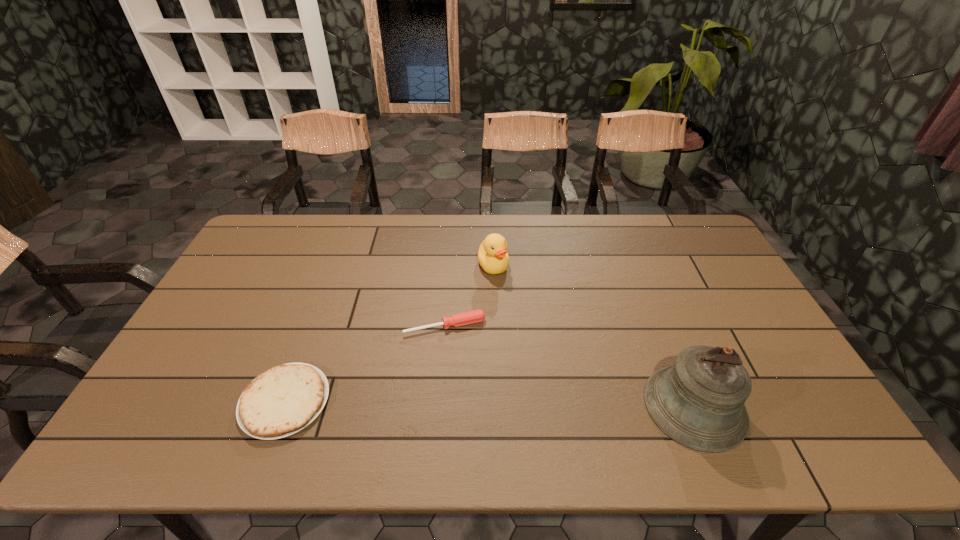
Locate an element on the screen. This screenshot has height=540, width=960. free space located at the beak of the farthest object is located at coordinates [x=515, y=329].

This screenshot has width=960, height=540. What are the coordinates of `vacant space located at the blade of the third nearest object` in the screenshot? It's located at (460, 349).

You are a GUI agent. You are given a task and a screenshot of the screen. Output one action in this format:
    pyautogui.click(x=<x>, y=<y>)
    Task: Click on the vacant region located 0.050m at the blade of the third nearest object
    The image size is (960, 540).
    Given the screenshot: What is the action you would take?
    pyautogui.click(x=460, y=349)

Where is `vacant region located 0.180m at the blade of the third nearest object`? The width and height of the screenshot is (960, 540). vacant region located 0.180m at the blade of the third nearest object is located at coordinates (471, 388).

Identify the location of object that is at the far edge. [492, 255].

What are the coordinates of `tortilla located in the near edge section of the desktop` in the screenshot? It's located at (283, 400).

Find the location of a particular element. The width and height of the screenshot is (960, 540). bell that is at the near edge is located at coordinates (698, 401).

Where is `free space at the far edge`? free space at the far edge is located at coordinates pos(396,227).

Locate an element on the screen. vacant space at the near edge of the desktop is located at coordinates (635, 389).

This screenshot has height=540, width=960. Identify the location of vacant position at the left edge of the desktop. (246, 338).